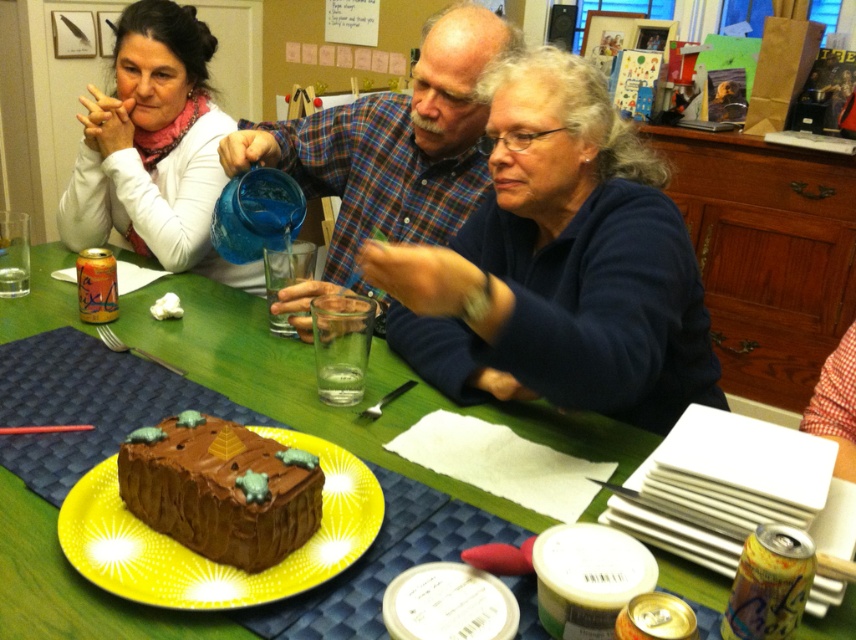
Question: Observing the image, what is the correct spatial positioning of matte white sweater at upper left in reference to yellow glossy plate at center?

Choices:
 (A) left
 (B) right

Answer: (A)

Question: Among these objects, which one is farthest from the camera?

Choices:
 (A) chocolatesmoothcake at center
 (B) matte white sweater at upper left
 (C) chocolate cake at lower left

Answer: (B)

Question: Can you confirm if blue plaid shirt at center is positioned to the left of matte white sweater at upper left?

Choices:
 (A) yes
 (B) no

Answer: (B)

Question: Which point is farther to the camera?

Choices:
 (A) green fabric table at center
 (B) blue plaid shirt at center
 (C) chocolatesmoothcake at center
 (D) chocolate cake at lower left

Answer: (B)

Question: Among these points, which one is farthest from the camera?

Choices:
 (A) (214, 598)
 (B) (217, 488)

Answer: (B)

Question: Does blue plaid shirt at center have a larger size compared to matte white sweater at upper left?

Choices:
 (A) yes
 (B) no

Answer: (A)